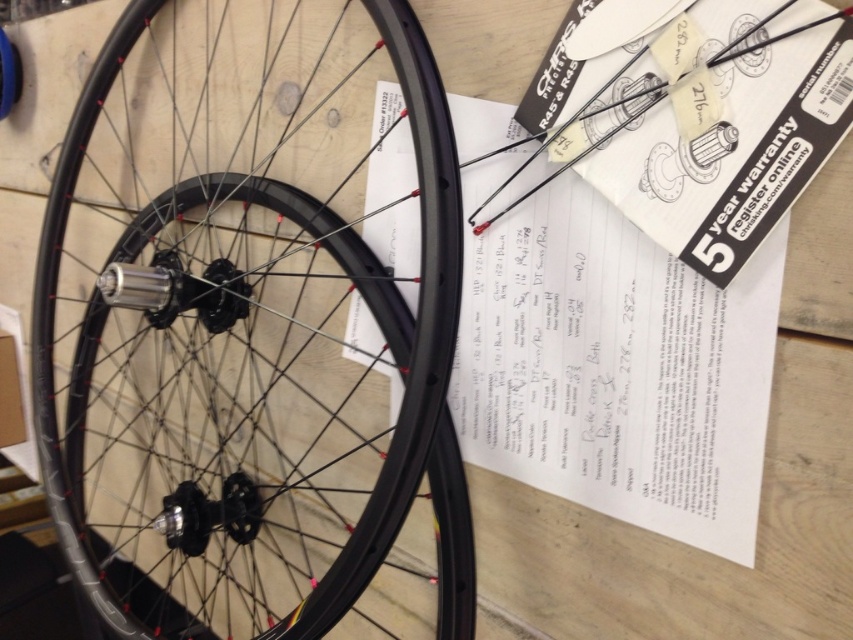
Which is more to the right, matte black rim at center or white paper at center?

Positioned to the right is white paper at center.

Where is `matte black rim at center`? This screenshot has height=640, width=853. matte black rim at center is located at coordinates (242, 324).